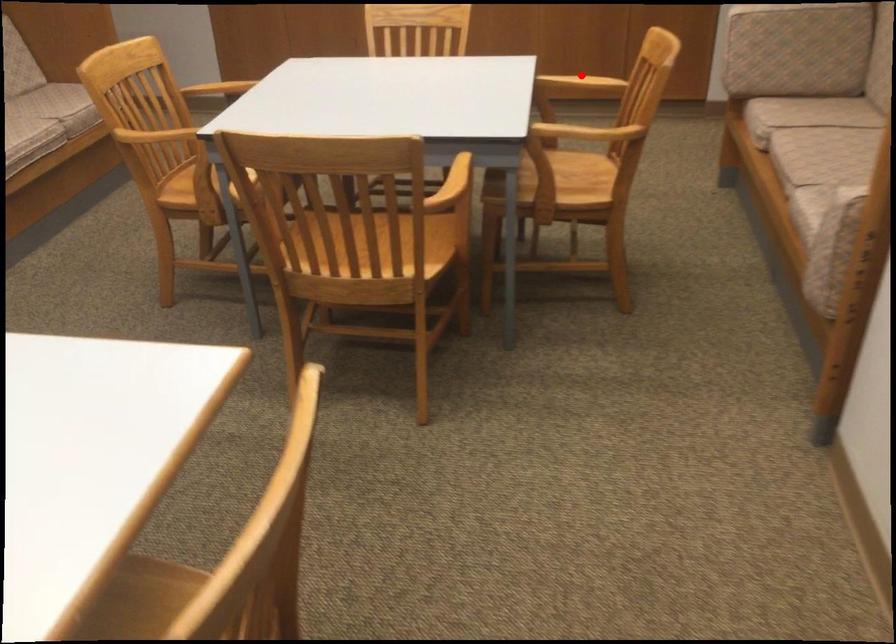
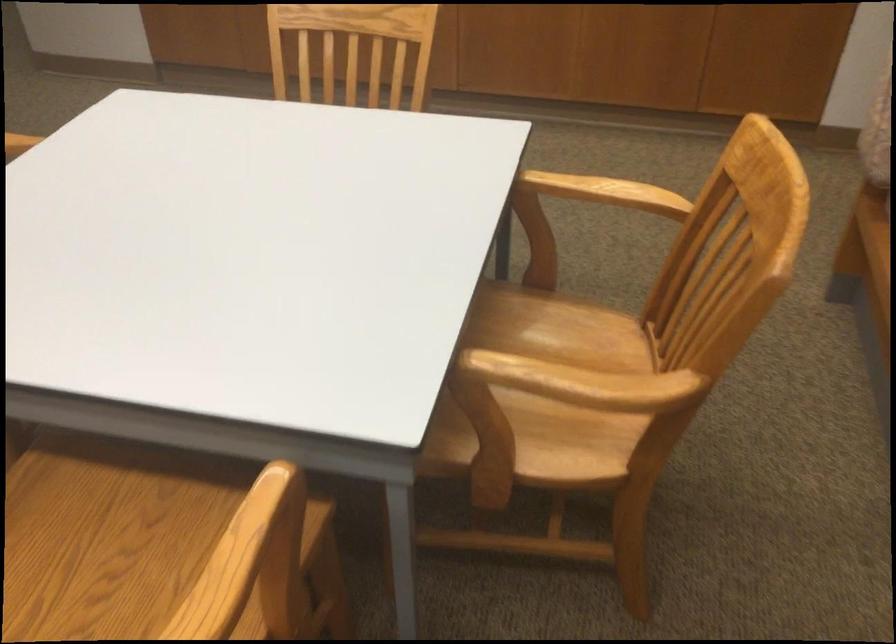
In the second image, find the point that corresponds to the highlighted location in the first image.

(605, 192)